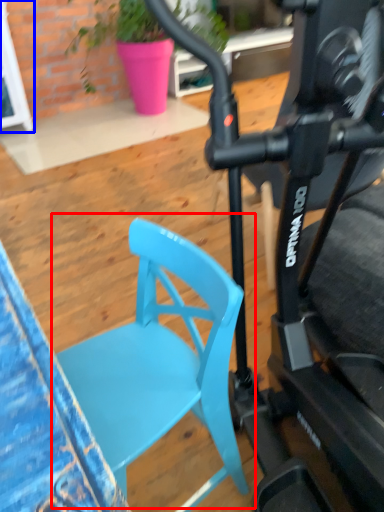
Question: Among these objects, which one is farthest to the camera, chair (highlighted by a red box) or glass door (highlighted by a blue box)?

Choices:
 (A) chair
 (B) glass door

Answer: (B)